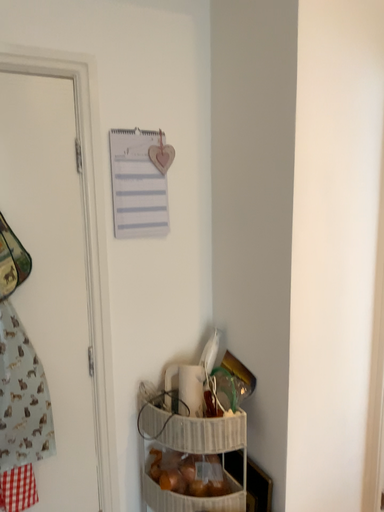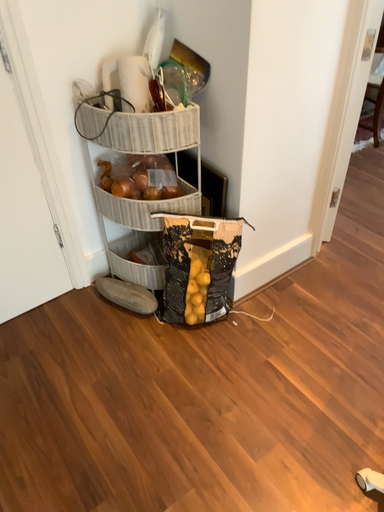
Question: Which way did the camera rotate in the video?

Choices:
 (A) rotated upward
 (B) rotated downward

Answer: (B)